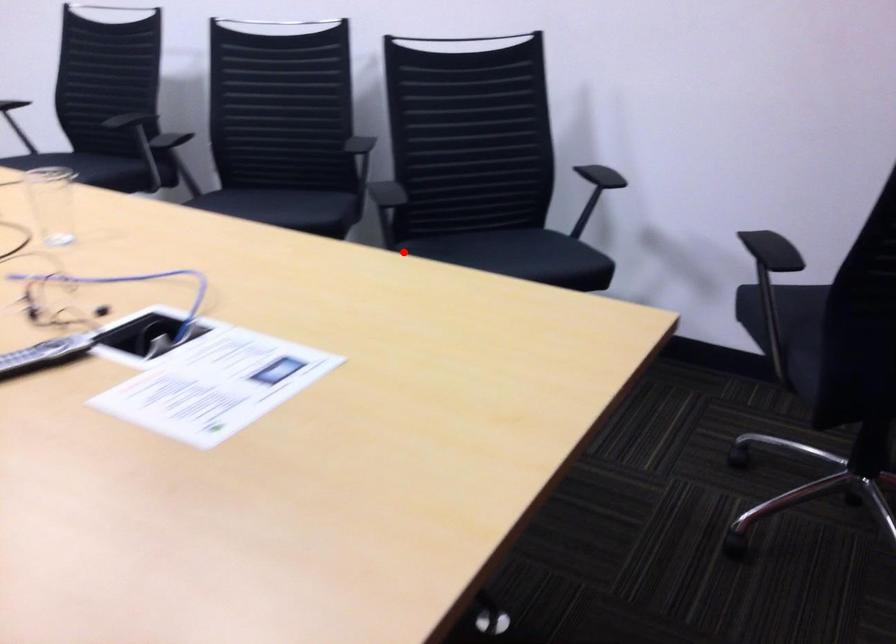
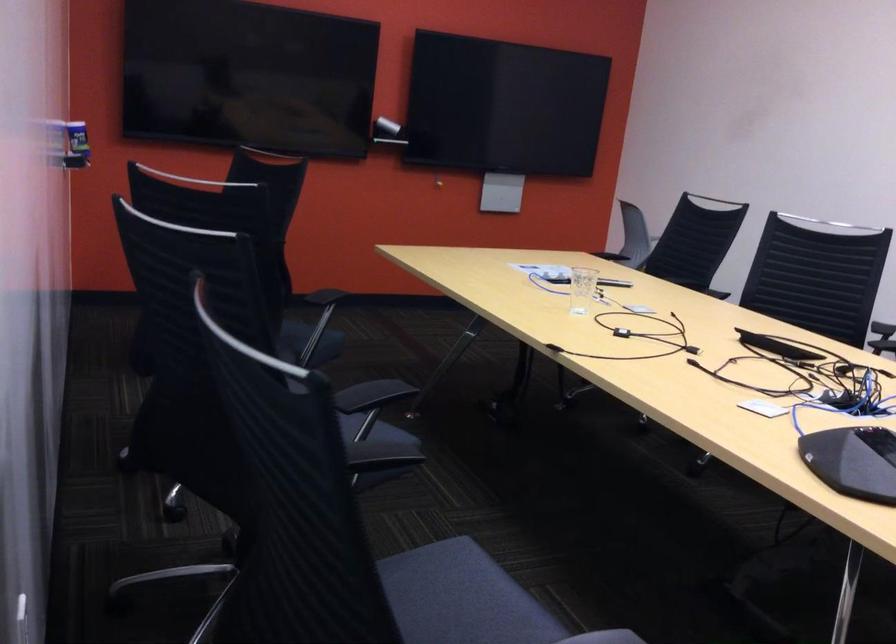
In the second image, find the point that corresponds to the highlighted location in the first image.

(308, 342)